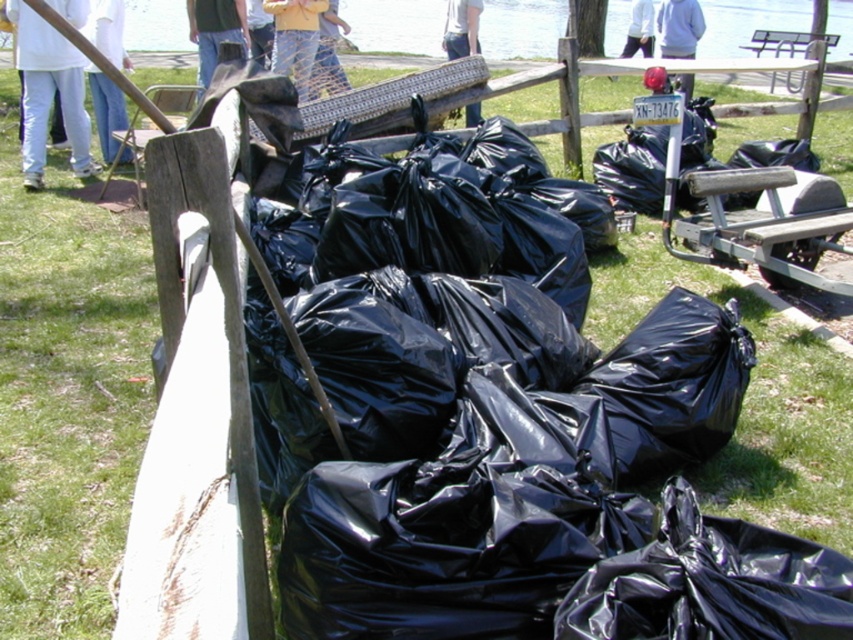
Question: Among these points, which one is farthest from the camera?

Choices:
 (A) (335, 77)
 (B) (213, 52)

Answer: (A)

Question: Does white cotton shirt at upper left have a smaller size compared to light blue shirt at upper center?

Choices:
 (A) no
 (B) yes

Answer: (A)

Question: Does denim pants at center appear over white shirt at upper center?

Choices:
 (A) yes
 (B) no

Answer: (B)

Question: Which is nearer to the wooden park bench at center?

Choices:
 (A) jeans at center
 (B) light blue shirt at upper center

Answer: (A)

Question: Is wooden park bench at center smaller than metallic silver park bench at upper center?

Choices:
 (A) no
 (B) yes

Answer: (B)

Question: Estimate the real-world distances between objects in this image. Which object is closer to the jeans at center?

Choices:
 (A) white cotton shirt at upper left
 (B) yellow shirt at center
 (C) white shirt at upper center
 (D) wooden park bench at center

Answer: (B)